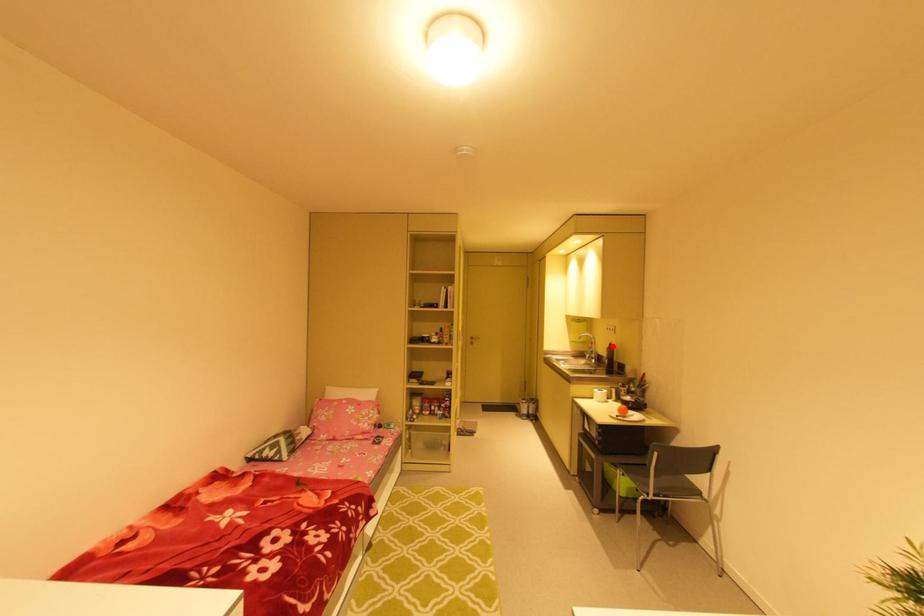
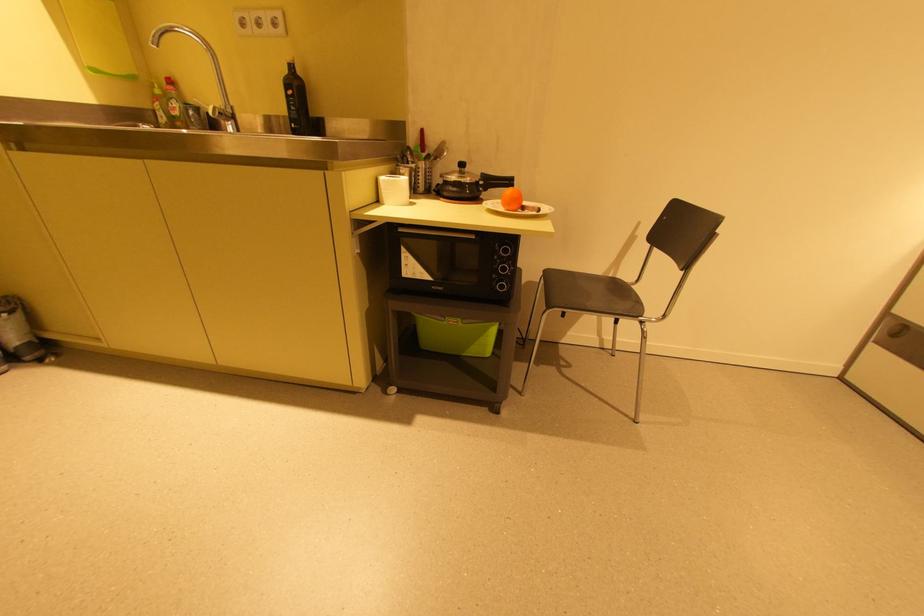
The point at the highlighted location is marked in the first image. Where is the corresponding point in the second image?

(289, 71)